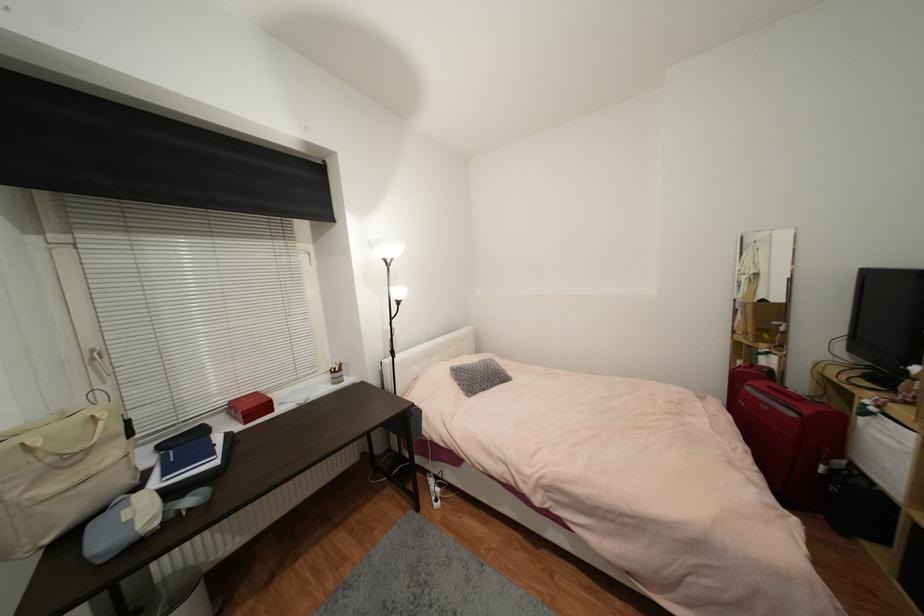
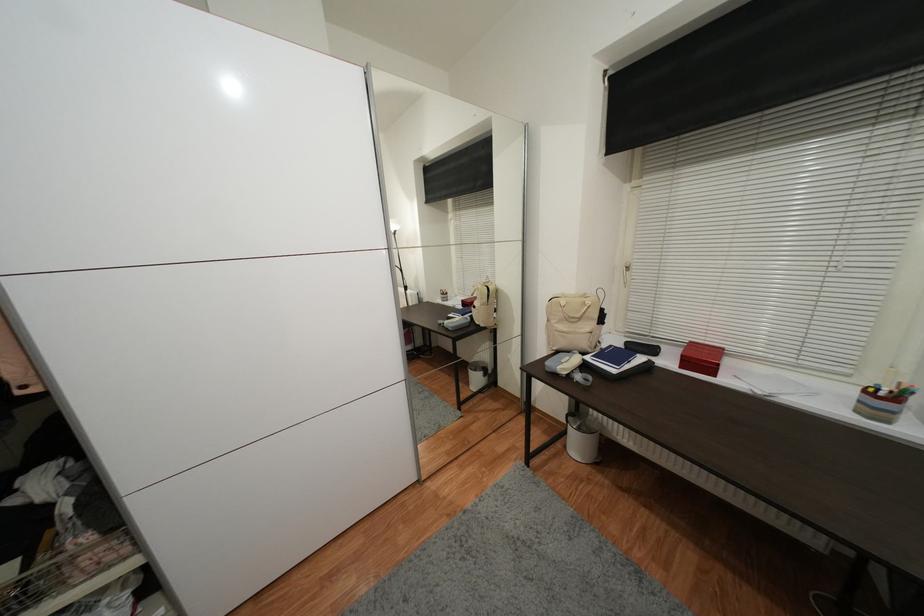
Find the pixel in the second image that matches point 131,231 in the first image.

(678, 167)